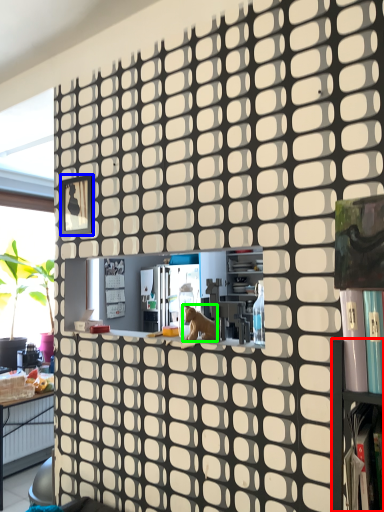
Question: Which object is positioned farthest from shelf (highlighted by a red box)? Select from square (highlighted by a blue box) and animal (highlighted by a green box).

Choices:
 (A) square
 (B) animal

Answer: (A)